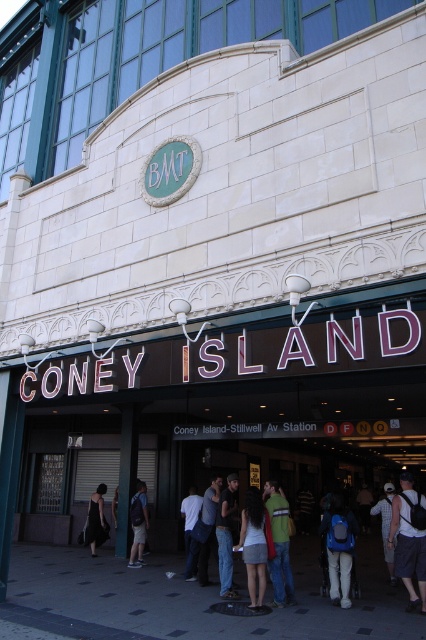
Question: Which object is the farthest from the blue backpack at center?

Choices:
 (A) dark blue jeans at center
 (B) khaki shorts at center

Answer: (B)

Question: Which point is closer to the camera?

Choices:
 (A) (328, 518)
 (B) (385, 554)
 (C) (198, 545)
 (D) (233, 492)

Answer: (A)

Question: Which point appears closest to the camera in this image?

Choices:
 (A) (137, 547)
 (B) (273, 596)
 (C) (224, 540)

Answer: (B)

Question: Is the position of green sweater at center less distant than that of black dress at center?

Choices:
 (A) no
 (B) yes

Answer: (B)

Question: From the image, what is the correct spatial relationship of denim jeans at center in relation to light blue denim jeans at center?

Choices:
 (A) below
 (B) above

Answer: (B)

Question: Does light gray denim shorts at center lie behind black dress at center?

Choices:
 (A) yes
 (B) no

Answer: (B)